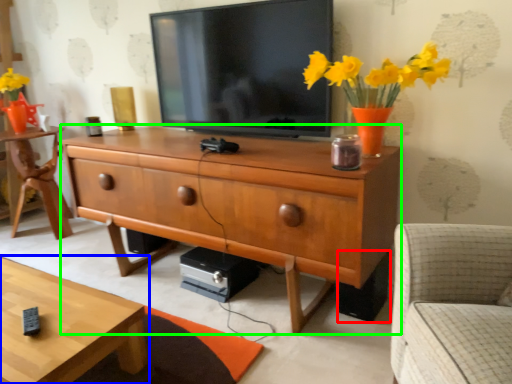
Question: Which object is positioned farthest from speaker (highlighted by a red box)? Select from coffee table (highlighted by a blue box) and chest of drawers (highlighted by a green box).

Choices:
 (A) coffee table
 (B) chest of drawers

Answer: (A)